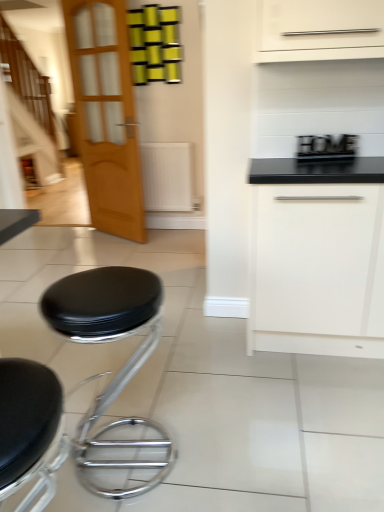
Question: From a real-world perspective, is black leather stool at lower left, arranged as the 2th stool when viewed from the back, located higher than white matte drawer at center right?

Choices:
 (A) yes
 (B) no

Answer: (B)

Question: From a real-world perspective, does black leather stool at lower left, the first stool when ordered from front to back, sit lower than white matte drawer at center right?

Choices:
 (A) yes
 (B) no

Answer: (A)

Question: Can white matte drawer at center right be found inside black leather stool at lower left, arranged as the 2th stool when viewed from the back?

Choices:
 (A) yes
 (B) no

Answer: (B)

Question: Is black leather stool at lower left, arranged as the 2th stool when viewed from the back, smaller than white matte drawer at center right?

Choices:
 (A) yes
 (B) no

Answer: (A)

Question: Can you see black leather stool at lower left, the first stool when ordered from front to back, touching white matte drawer at center right?

Choices:
 (A) yes
 (B) no

Answer: (B)

Question: In the image, is light brown wooden door at left on the left side or the right side of black leather stool at lower left, the first stool when ordered from front to back?

Choices:
 (A) left
 (B) right

Answer: (A)

Question: Is point (77, 121) positioned closer to the camera than point (66, 440)?

Choices:
 (A) farther
 (B) closer

Answer: (A)

Question: From the image's perspective, is light brown wooden door at left positioned above or below black leather stool at lower left, arranged as the 2th stool when viewed from the back?

Choices:
 (A) below
 (B) above

Answer: (B)

Question: Looking at their shapes, would you say light brown wooden door at left is wider or thinner than black leather stool at lower left, the first stool when ordered from front to back?

Choices:
 (A) thin
 (B) wide

Answer: (A)

Question: From a real-world perspective, relative to black leather stool at lower left, the 1th stool viewed from the back, is black leather stool at lower left, arranged as the 2th stool when viewed from the back, vertically above or below?

Choices:
 (A) below
 (B) above

Answer: (B)

Question: In the image, is black leather stool at lower left, arranged as the 2th stool when viewed from the back, positioned in front of or behind black leather stool at lower left, the 1th stool viewed from the back?

Choices:
 (A) behind
 (B) front

Answer: (B)

Question: In the image, is black leather stool at lower left, arranged as the 2th stool when viewed from the back, on the left side or the right side of black leather stool at lower left, the second stool from the front?

Choices:
 (A) left
 (B) right

Answer: (A)

Question: From the image's perspective, is black leather stool at lower left, the first stool when ordered from front to back, above or below black leather stool at lower left, the second stool from the front?

Choices:
 (A) below
 (B) above

Answer: (A)

Question: Would you say light brown wooden door at left is inside or outside white matte drawer at center right?

Choices:
 (A) inside
 (B) outside

Answer: (B)

Question: From their relative heights in the image, would you say light brown wooden door at left is taller or shorter than white matte drawer at center right?

Choices:
 (A) short
 (B) tall

Answer: (B)